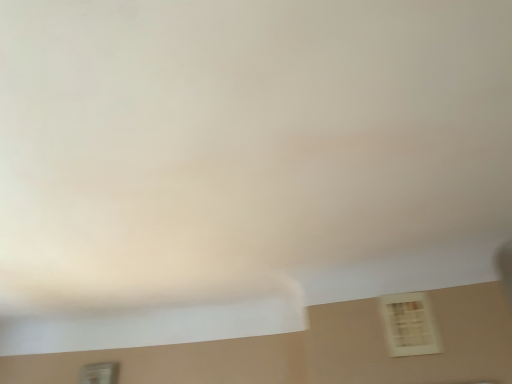
Question: Does white matte window at lower right, which ranks as the 1th window in top-to-bottom order, have a greater height compared to white plastic window at lower left, positioned as the first window in bottom-to-top order?

Choices:
 (A) yes
 (B) no

Answer: (B)

Question: From a real-world perspective, is white matte window at lower right, the 2th window positioned from the back, below white plastic window at lower left, which ranks as the first window in left-to-right order?

Choices:
 (A) yes
 (B) no

Answer: (B)

Question: Does white matte window at lower right, which ranks as the 1th window in top-to-bottom order, lie in front of white plastic window at lower left, marked as the 2th window in a right-to-left arrangement?

Choices:
 (A) no
 (B) yes

Answer: (B)

Question: Is white matte window at lower right, the 2th window positioned from the back, further to the viewer compared to white plastic window at lower left, marked as the 2th window in a right-to-left arrangement?

Choices:
 (A) no
 (B) yes

Answer: (A)

Question: Is white matte window at lower right, arranged as the first window when viewed from the right, completely or partially outside of white plastic window at lower left, which is the second window in front-to-back order?

Choices:
 (A) no
 (B) yes

Answer: (B)

Question: Can you confirm if white matte window at lower right, acting as the 2th window starting from the left, is positioned to the left of white plastic window at lower left, which ranks as the first window in back-to-front order?

Choices:
 (A) no
 (B) yes

Answer: (A)

Question: Is white plastic window at lower left, which ranks as the first window in back-to-front order, at the right side of white matte window at lower right, which ranks as the 1th window in top-to-bottom order?

Choices:
 (A) no
 (B) yes

Answer: (A)

Question: Does white plastic window at lower left, which is the second window in front-to-back order, have a smaller size compared to white matte window at lower right, arranged as the first window when viewed from the right?

Choices:
 (A) yes
 (B) no

Answer: (B)

Question: From the image's perspective, does white plastic window at lower left, the 2th window when ordered from top to bottom, appear higher than white matte window at lower right, the 2th window positioned from the back?

Choices:
 (A) yes
 (B) no

Answer: (B)

Question: Would you say white matte window at lower right, the first window positioned from the front, is part of white plastic window at lower left, the 2th window when ordered from top to bottom,'s contents?

Choices:
 (A) yes
 (B) no

Answer: (B)

Question: From a real-world perspective, is white plastic window at lower left, positioned as the first window in bottom-to-top order, beneath white matte window at lower right, the second window when ordered from bottom to top?

Choices:
 (A) yes
 (B) no

Answer: (A)

Question: Considering the relative sizes of white plastic window at lower left, which ranks as the first window in left-to-right order, and white matte window at lower right, the second window when ordered from bottom to top, in the image provided, is white plastic window at lower left, which ranks as the first window in left-to-right order, bigger than white matte window at lower right, the second window when ordered from bottom to top,?

Choices:
 (A) yes
 (B) no

Answer: (A)

Question: Visually, is white plastic window at lower left, the 2th window when ordered from top to bottom, positioned to the left or to the right of white matte window at lower right, the first window positioned from the front?

Choices:
 (A) right
 (B) left

Answer: (B)